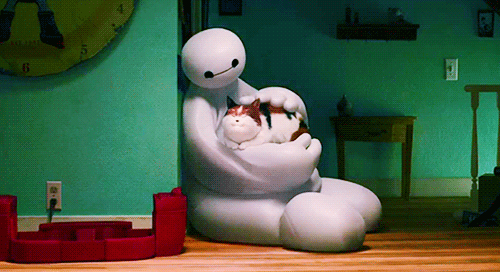
The width and height of the screenshot is (500, 272). I want to click on framed photo, so click(x=486, y=26).